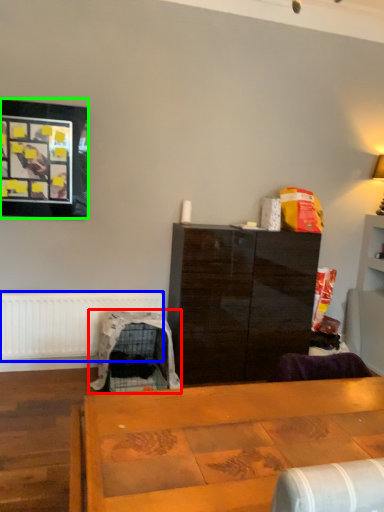
Question: Considering the real-world distances, which object is closest to swivel chair (highlighted by a red box)? radiator (highlighted by a blue box) or picture frame (highlighted by a green box).

Choices:
 (A) radiator
 (B) picture frame

Answer: (A)